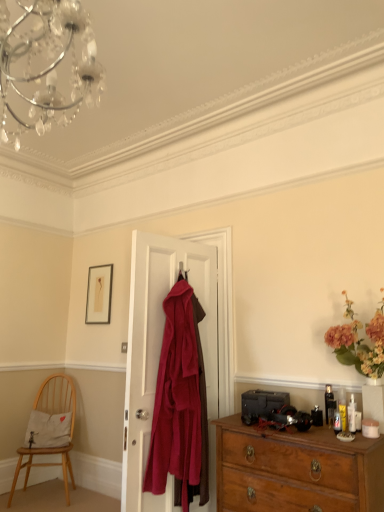
Question: Is light wood chair at lower left completely or partially inside velvet burgundy coat at center?

Choices:
 (A) yes
 (B) no

Answer: (B)

Question: Does velvet burgundy coat at center have a greater height compared to light wood chair at lower left?

Choices:
 (A) no
 (B) yes

Answer: (B)

Question: From the image's perspective, is velvet burgundy coat at center beneath light wood chair at lower left?

Choices:
 (A) yes
 (B) no

Answer: (B)

Question: Considering the relative sizes of velvet burgundy coat at center and light wood chair at lower left in the image provided, is velvet burgundy coat at center thinner than light wood chair at lower left?

Choices:
 (A) yes
 (B) no

Answer: (A)

Question: Would you say velvet burgundy coat at center is a long distance from light wood chair at lower left?

Choices:
 (A) no
 (B) yes

Answer: (B)

Question: Is light wood chair at lower left wider or thinner than velvet burgundy coat at center?

Choices:
 (A) thin
 (B) wide

Answer: (B)

Question: Considering their positions, is light wood chair at lower left located in front of or behind velvet burgundy coat at center?

Choices:
 (A) front
 (B) behind

Answer: (B)

Question: Would you say light wood chair at lower left is to the left or to the right of velvet burgundy coat at center in the picture?

Choices:
 (A) left
 (B) right

Answer: (A)

Question: Considering the positions of light wood chair at lower left and velvet burgundy coat at center in the image, is light wood chair at lower left bigger or smaller than velvet burgundy coat at center?

Choices:
 (A) big
 (B) small

Answer: (A)

Question: In terms of height, does matte gold picture frame at upper left look taller or shorter compared to wooden chest of drawers at lower right?

Choices:
 (A) tall
 (B) short

Answer: (B)

Question: Does point (105, 315) appear closer or farther from the camera than point (241, 454)?

Choices:
 (A) closer
 (B) farther

Answer: (B)

Question: Considering the positions of matte gold picture frame at upper left and wooden chest of drawers at lower right in the image, is matte gold picture frame at upper left bigger or smaller than wooden chest of drawers at lower right?

Choices:
 (A) big
 (B) small

Answer: (B)

Question: In the image, is matte gold picture frame at upper left positioned in front of or behind wooden chest of drawers at lower right?

Choices:
 (A) behind
 (B) front

Answer: (A)

Question: From the image's perspective, is light wood chair at lower left above or below wooden chest of drawers at lower right?

Choices:
 (A) below
 (B) above

Answer: (A)

Question: Do you think light wood chair at lower left is within wooden chest of drawers at lower right, or outside of it?

Choices:
 (A) inside
 (B) outside

Answer: (B)